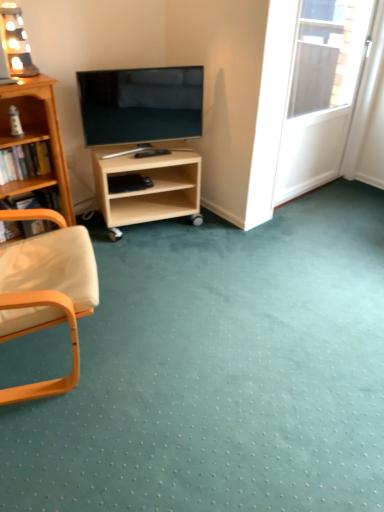
What do you see at coordinates (36, 136) in the screenshot? I see `wooden bookcase at left` at bounding box center [36, 136].

Image resolution: width=384 pixels, height=512 pixels. Find the location of `wooden bookcase at left`. wooden bookcase at left is located at coordinates (36, 136).

How much space does wooden bookshelf at left, which is counted as the first book, starting from the top, occupy horizontally?

The width of wooden bookshelf at left, which is counted as the first book, starting from the top, is 8.53 inches.

This screenshot has width=384, height=512. Find the location of `wooden lamp at upper left`. wooden lamp at upper left is located at coordinates (16, 42).

What is the approximate width of wooden chair arm at left, which is the 1th book from bottom to top?

The width of wooden chair arm at left, which is the 1th book from bottom to top, is 23.11 centimeters.

Measure the distance between point (x=17, y=200) and camera.

The distance of point (x=17, y=200) from camera is 2.57 meters.

Locate an element on the screen. The image size is (384, 512). light wood/unfinishedobject at center is located at coordinates coord(148,188).

What's the angular difference between matte black tv at center and wooden bookcase at left's facing directions?

22.3 degrees.

Are matte black tv at center and wooden bookcase at left far apart?

Actually, matte black tv at center and wooden bookcase at left are a little close together.

Is matte black tv at center located outside wooden bookcase at left?

matte black tv at center is positioned outside wooden bookcase at left.

Considering the relative positions of matte black tv at center and wooden lamp at upper left in the image provided, is matte black tv at center to the right of wooden lamp at upper left from the viewer's perspective?

Yes.

How far apart are matte black tv at center and wooden lamp at upper left?

matte black tv at center and wooden lamp at upper left are 56.21 centimeters apart from each other.

Is matte black tv at center taller than wooden lamp at upper left?

Indeed, matte black tv at center has a greater height compared to wooden lamp at upper left.

From a real-world perspective, which is physically above, matte black tv at center or wooden lamp at upper left?

wooden lamp at upper left, from a real-world perspective.

Is the depth of wooden chair arm at left, which is counted as the second book, starting from the top, greater than that of wooden armchair at left?

Yes, wooden chair arm at left, which is counted as the second book, starting from the top, is behind wooden armchair at left.

From the picture: Is wooden chair arm at left, which is the 1th book from bottom to top, completely or partially outside of wooden armchair at left?

Indeed, wooden chair arm at left, which is the 1th book from bottom to top, is completely outside wooden armchair at left.

Does wooden bookshelf at left, the 2th book when ordered from bottom to top, lie in front of wooden armchair at left?

No, the depth of wooden bookshelf at left, the 2th book when ordered from bottom to top, is greater than that of wooden armchair at left.

Is wooden bookshelf at left, the 2th book when ordered from bottom to top, aimed at wooden armchair at left?

Yes, wooden bookshelf at left, the 2th book when ordered from bottom to top, is facing wooden armchair at left.

Which is more to the right, wooden bookshelf at left, the 2th book when ordered from bottom to top, or wooden armchair at left?

wooden armchair at left.

In terms of height, does white glossy screen door at upper right look taller or shorter compared to matte black tv at center?

white glossy screen door at upper right is taller than matte black tv at center.

Is white glossy screen door at upper right not close to matte black tv at center?

Absolutely, white glossy screen door at upper right is distant from matte black tv at center.

Does white glossy screen door at upper right turn towards matte black tv at center?

No, white glossy screen door at upper right is not oriented towards matte black tv at center.

Can you tell me how much white glossy screen door at upper right and matte black tv at center differ in facing direction?

There is a 24.2-degree angle between the facing directions of white glossy screen door at upper right and matte black tv at center.

Consider the image. How many degrees apart are the facing directions of wooden bookcase at left and white glossy screen door at upper right?

The facing directions of wooden bookcase at left and white glossy screen door at upper right are 1.92 degrees apart.

Does point (61, 182) appear closer or farther from the camera than point (316, 71)?

Point (61, 182).

From the image's perspective, is wooden bookcase at left beneath white glossy screen door at upper right?

Indeed, from the image's perspective, wooden bookcase at left is shown beneath white glossy screen door at upper right.

From a real-world perspective, does wooden lamp at upper left sit lower than white glossy screen door at upper right?

No, from a real-world perspective, wooden lamp at upper left is not below white glossy screen door at upper right.

How different are the orientations of wooden lamp at upper left and white glossy screen door at upper right in degrees?

The angle between the facing direction of wooden lamp at upper left and the facing direction of white glossy screen door at upper right is 8.89 degrees.

From the image's perspective, who appears lower, wooden lamp at upper left or white glossy screen door at upper right?

white glossy screen door at upper right.

Are wooden lamp at upper left and white glossy screen door at upper right beside each other?

wooden lamp at upper left is not next to white glossy screen door at upper right, and they're not touching.

You are a GUI agent. You are given a task and a screenshot of the screen. Output one action in this format:
    pyautogui.click(x=<x>, y=<y>)
    Task: Click on the television that appears behind the wooden bookcase at left
    The image size is (384, 512).
    Given the screenshot: What is the action you would take?
    pyautogui.click(x=141, y=104)

Find the location of a particular element. television below the wooden lamp at upper left (from a real-world perspective) is located at coordinates (141, 104).

From the picture: Estimate the real-world distances between objects in this image. Which object is further from matte black tv at center, wooden armchair at left or wooden bookshelf at left, the 2th book when ordered from bottom to top?

wooden armchair at left is further to matte black tv at center.

When comparing their distances from wooden lamp at upper left, does white glossy screen door at upper right or matte black tv at center seem closer?

The object closer to wooden lamp at upper left is matte black tv at center.

Estimate the real-world distances between objects in this image. Which object is further from wooden bookshelf at left, the 2th book when ordered from bottom to top, light wood/unfinishedobject at center or white glossy screen door at upper right?

The object further to wooden bookshelf at left, the 2th book when ordered from bottom to top, is white glossy screen door at upper right.

From the image, which object appears to be farther from white glossy screen door at upper right, wooden chair arm at left, which is the 1th book from bottom to top, or wooden armchair at left?

The object further to white glossy screen door at upper right is wooden armchair at left.

Which object lies nearer to the anchor point wooden armchair at left, light wood/unfinishedobject at center or wooden chair arm at left, which is counted as the second book, starting from the top?

wooden chair arm at left, which is counted as the second book, starting from the top.

When comparing their distances from white glossy screen door at upper right, does wooden bookcase at left or wooden armchair at left seem further?

wooden armchair at left is positioned further to the anchor white glossy screen door at upper right.

Which object lies nearer to the anchor point wooden lamp at upper left, wooden bookcase at left or matte black tv at center?

wooden bookcase at left is positioned closer to the anchor wooden lamp at upper left.

From the image, which object appears to be nearer to white glossy screen door at upper right, light wood/unfinishedobject at center or wooden bookcase at left?

light wood/unfinishedobject at center is closer to white glossy screen door at upper right.

Locate an element on the screen. The width and height of the screenshot is (384, 512). bookcase between wooden armchair at left and matte black tv at center in the front-back direction is located at coordinates (36, 136).

The width and height of the screenshot is (384, 512). I want to click on book between wooden chair arm at left, which is counted as the second book, starting from the top, and white glossy screen door at upper right, so click(x=24, y=161).

The height and width of the screenshot is (512, 384). I want to click on chair located between wooden lamp at upper left and white glossy screen door at upper right in the left-right direction, so click(x=46, y=291).

Image resolution: width=384 pixels, height=512 pixels. I want to click on shelf situated between wooden lamp at upper left and white glossy screen door at upper right from left to right, so click(x=148, y=188).